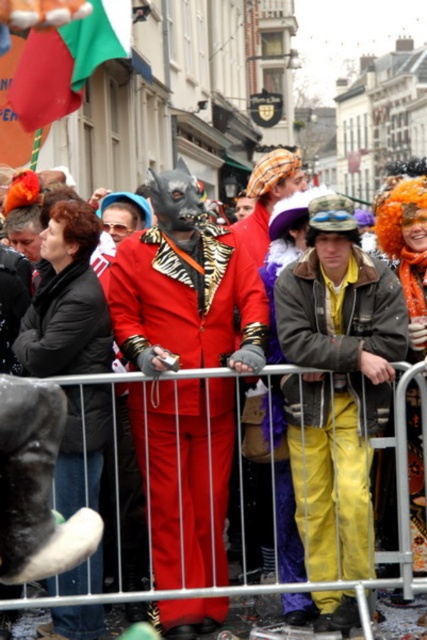
You are standing at the viewpoint of the image and want to walk towards the point closer to you. Which point should you head towards, point (x=363, y=480) or point (x=43, y=292)?

You should head towards point (x=363, y=480) because it is in front of point (x=43, y=292), making it closer to your current position.